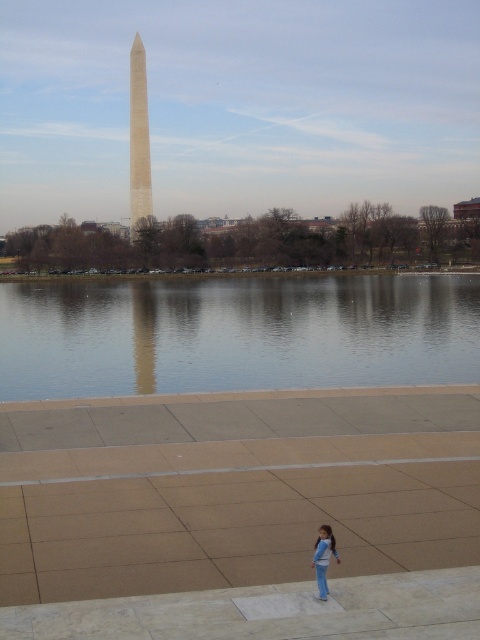
Does smooth reflective water at center have a greater height compared to blue denim jeans at lower center?

Yes, smooth reflective water at center is taller than blue denim jeans at lower center.

Who is lower down, smooth reflective water at center or blue denim jeans at lower center?

blue denim jeans at lower center is lower down.

Who is more forward, (160, 358) or (322, 554)?

Point (322, 554) is in front.

Identify the location of smooth reflective water at center. (236, 333).

Identify the location of smooth reflective water at center. The height and width of the screenshot is (640, 480). (236, 333).

I want to click on smooth reflective water at center, so click(x=236, y=333).

Does smooth white obelisk at center have a greater height compared to blue denim jeans at lower center?

Yes, smooth white obelisk at center is taller than blue denim jeans at lower center.

Can you confirm if smooth white obelisk at center is positioned below blue denim jeans at lower center?

No.

At what (x,y) coordinates should I click in order to perform the action: click on smooth white obelisk at center. Please return your answer as a coordinate pair (x, y). The height and width of the screenshot is (640, 480). Looking at the image, I should click on (139, 141).